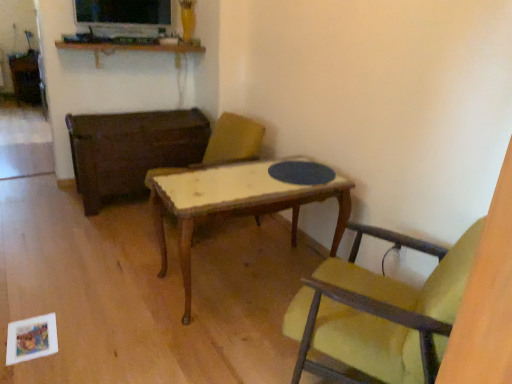
Question: Is the position of wooden shelf at upper center more distant than that of wooden table at center?

Choices:
 (A) no
 (B) yes

Answer: (B)

Question: Is wooden shelf at upper center oriented away from wooden table at center?

Choices:
 (A) yes
 (B) no

Answer: (B)

Question: Is wooden table at center surrounded by wooden shelf at upper center?

Choices:
 (A) no
 (B) yes

Answer: (A)

Question: Considering the relative sizes of wooden shelf at upper center and wooden table at center in the image provided, is wooden shelf at upper center smaller than wooden table at center?

Choices:
 (A) no
 (B) yes

Answer: (B)

Question: From a real-world perspective, is wooden shelf at upper center under wooden table at center?

Choices:
 (A) yes
 (B) no

Answer: (B)

Question: In the image, is wooden textured chair at center, which ranks as the 2th chair in front-to-back order, positioned in front of or behind yellow fabric chair at center, which is the second chair in back-to-front order?

Choices:
 (A) front
 (B) behind

Answer: (B)

Question: In terms of height, does wooden textured chair at center, the 2th chair in the right-to-left sequence, look taller or shorter compared to yellow fabric chair at center, which is the second chair in back-to-front order?

Choices:
 (A) short
 (B) tall

Answer: (B)

Question: In terms of width, does wooden textured chair at center, the first chair in the back-to-front sequence, look wider or thinner when compared to yellow fabric chair at center, acting as the 1th chair starting from the right?

Choices:
 (A) wide
 (B) thin

Answer: (A)

Question: From the image's perspective, is wooden textured chair at center, acting as the first chair starting from the left, positioned above or below yellow fabric chair at center, the 1th chair in the front-to-back sequence?

Choices:
 (A) above
 (B) below

Answer: (A)

Question: From the image's perspective, is yellow fabric chair at center, which appears as the 2th chair when viewed from the left, positioned above or below wooden table at center?

Choices:
 (A) below
 (B) above

Answer: (A)

Question: Looking at their shapes, would you say yellow fabric chair at center, which appears as the 2th chair when viewed from the left, is wider or thinner than wooden table at center?

Choices:
 (A) thin
 (B) wide

Answer: (A)

Question: Does point (429, 312) appear closer or farther from the camera than point (121, 130)?

Choices:
 (A) farther
 (B) closer

Answer: (B)

Question: Do you think yellow fabric chair at center, the 1th chair in the front-to-back sequence, is within wooden table at center, or outside of it?

Choices:
 (A) inside
 (B) outside

Answer: (B)

Question: From the image's perspective, is wooden textured chair at center, which ranks as the 2th chair in front-to-back order, positioned above or below wooden shelf at upper center?

Choices:
 (A) below
 (B) above

Answer: (A)

Question: Considering the relative positions of wooden textured chair at center, acting as the first chair starting from the left, and wooden shelf at upper center in the image provided, is wooden textured chair at center, acting as the first chair starting from the left, to the left or to the right of wooden shelf at upper center?

Choices:
 (A) right
 (B) left

Answer: (A)